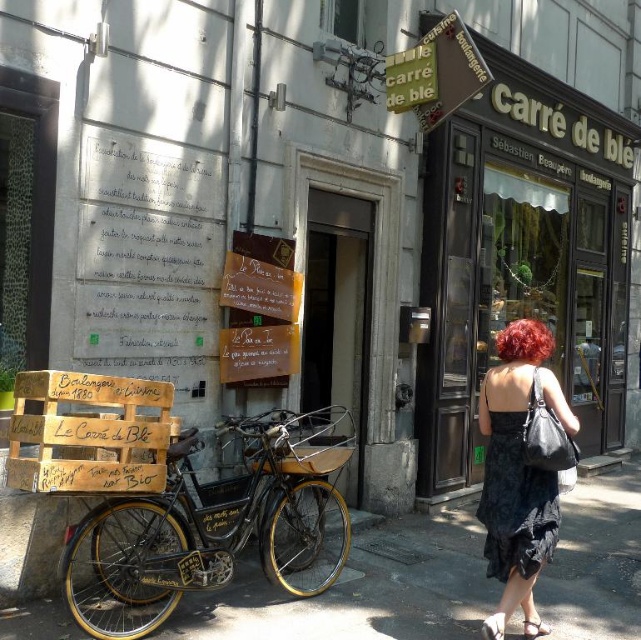
You are a delivery person who needs to carry a package from the bakery to a nearby address. You see a rustic metal bicycle at center and a shiny red hair at center right. Which object can you use to carry the package?

The rustic metal bicycle at center can be used to carry the package since it is a vehicle, while the shiny red hair at center right is part of a person and cannot be used for carrying items.

What is the spatial relationship between the wooden crate at lower left and the shiny red hair at center right in the scene?

The wooden crate at lower left is positioned on the left side of shiny red hair at center right.